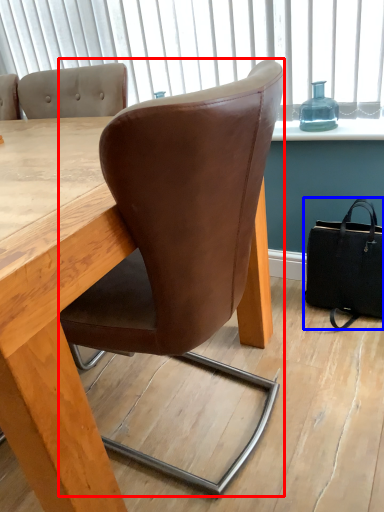
Question: Among these objects, which one is farthest to the camera, chair (highlighted by a red box) or handbag (highlighted by a blue box)?

Choices:
 (A) chair
 (B) handbag

Answer: (B)